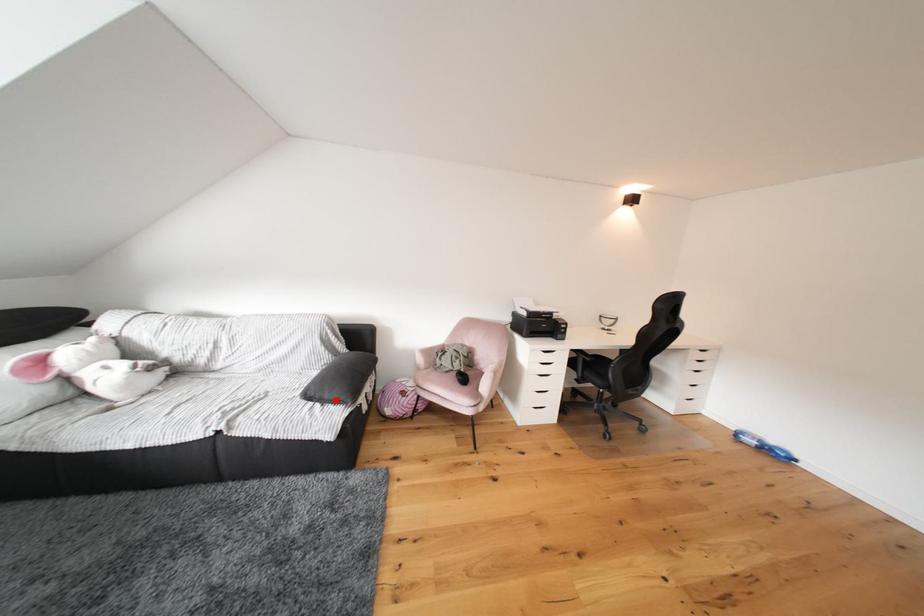
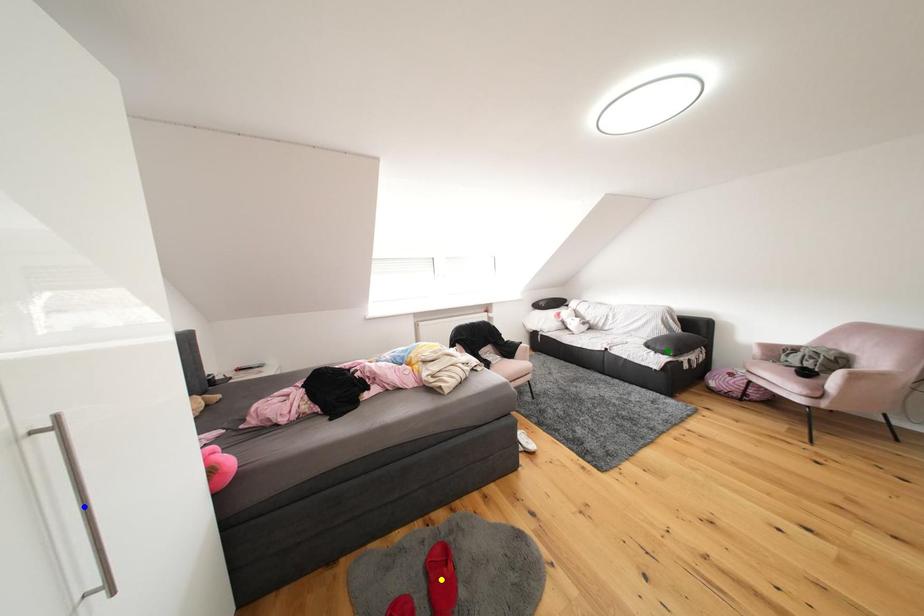
Question: I am providing you with two images of the same scene from different viewpoints. A red point is marked on the first image. You are given multiple points on the second image. Which spot in image 2 lines up with the point in image 1?

Choices:
 (A) green point
 (B) yellow point
 (C) blue point

Answer: (A)